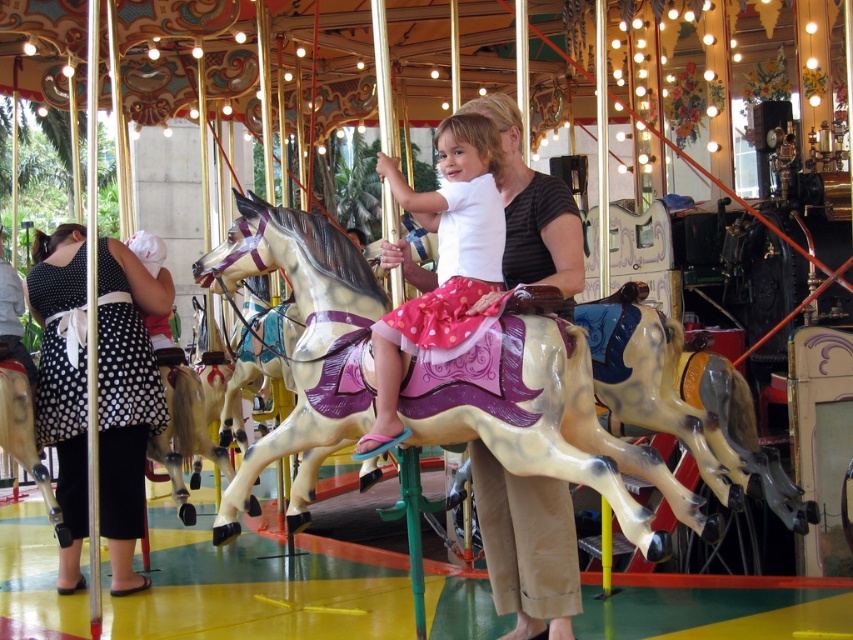
Between painted wood horse at center and matte black shirt at center, which one has more height?

With more height is matte black shirt at center.

Between point (315, 323) and point (563, 529), which one is positioned in front?

Point (315, 323) is more forward.

Identify the location of painted wood horse at center. The height and width of the screenshot is (640, 853). (541, 417).

At what (x,y) coordinates should I click in order to perform the action: click on painted wood horse at center. Please return your answer as a coordinate pair (x, y). Looking at the image, I should click on (541, 417).

Can you confirm if painted wood horse at center is positioned above black dotted dress at left?

Actually, painted wood horse at center is below black dotted dress at left.

Is painted wood horse at center shorter than black dotted dress at left?

Yes, painted wood horse at center is shorter than black dotted dress at left.

Does point (300, 524) come behind point (105, 513)?

That is False.

You are a GUI agent. You are given a task and a screenshot of the screen. Output one action in this format:
    pyautogui.click(x=<x>, y=<y>)
    Task: Click on the painted wood horse at center
    
    Given the screenshot: What is the action you would take?
    pyautogui.click(x=541, y=417)

Is black dotted dress at left to the left of matte black shirt at center from the viewer's perspective?

Correct, you'll find black dotted dress at left to the left of matte black shirt at center.

Can you confirm if black dotted dress at left is positioned above matte black shirt at center?

No.

What do you see at coordinates (125, 401) in the screenshot?
I see `black dotted dress at left` at bounding box center [125, 401].

Where is `black dotted dress at left`? The image size is (853, 640). black dotted dress at left is located at coordinates (125, 401).